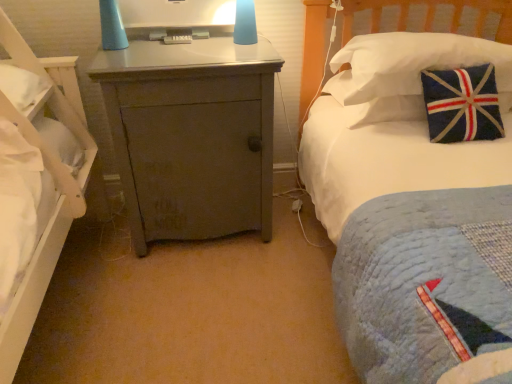
Where is `free location in front of matte gray cabinet at center`? Image resolution: width=512 pixels, height=384 pixels. free location in front of matte gray cabinet at center is located at coordinates (188, 305).